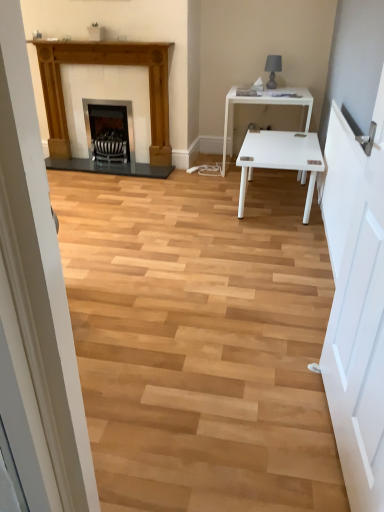
Question: Is matte black fireplace at center, which appears as the first fireplace when viewed from the right, completely or partially outside of matte black lamp at upper right?

Choices:
 (A) no
 (B) yes

Answer: (B)

Question: Is matte black fireplace at center, which appears as the first fireplace when viewed from the right, far away from matte black lamp at upper right?

Choices:
 (A) yes
 (B) no

Answer: (A)

Question: Does matte black fireplace at center, which appears as the first fireplace when viewed from the right, have a lesser width compared to matte black lamp at upper right?

Choices:
 (A) yes
 (B) no

Answer: (B)

Question: From the image's perspective, does matte black fireplace at center, which is the second fireplace from left to right, appear lower than matte black lamp at upper right?

Choices:
 (A) yes
 (B) no

Answer: (A)

Question: Considering the relative sizes of matte black fireplace at center, which is the second fireplace from left to right, and matte black lamp at upper right in the image provided, is matte black fireplace at center, which is the second fireplace from left to right, bigger than matte black lamp at upper right?

Choices:
 (A) yes
 (B) no

Answer: (A)

Question: Considering their positions, is white wooden door at right located in front of or behind matte black lamp at upper right?

Choices:
 (A) front
 (B) behind

Answer: (A)

Question: Based on their positions, is white wooden door at right located to the left or right of matte black lamp at upper right?

Choices:
 (A) left
 (B) right

Answer: (A)

Question: Is white wooden door at right wider or thinner than matte black lamp at upper right?

Choices:
 (A) wide
 (B) thin

Answer: (B)

Question: Considering the positions of point (337, 266) and point (271, 74), is point (337, 266) closer or farther from the camera than point (271, 74)?

Choices:
 (A) farther
 (B) closer

Answer: (B)

Question: In the image, is matte black fireplace at center, which is the second fireplace from left to right, positioned in front of or behind matte black lamp at upper right?

Choices:
 (A) front
 (B) behind

Answer: (B)

Question: Looking at the image, does matte black fireplace at center, which is the second fireplace from left to right, seem bigger or smaller compared to matte black lamp at upper right?

Choices:
 (A) big
 (B) small

Answer: (A)

Question: In terms of height, does matte black fireplace at center, which is the second fireplace from left to right, look taller or shorter compared to matte black lamp at upper right?

Choices:
 (A) short
 (B) tall

Answer: (B)

Question: In the image, is matte black fireplace at center, which is the second fireplace from left to right, on the left side or the right side of matte black lamp at upper right?

Choices:
 (A) right
 (B) left

Answer: (B)

Question: From the image's perspective, is wooden fireplace at left, the 2th fireplace from the right, above or below white glossy table at center?

Choices:
 (A) above
 (B) below

Answer: (A)

Question: Is wooden fireplace at left, which appears as the first fireplace when viewed from the left, situated inside white glossy table at center or outside?

Choices:
 (A) inside
 (B) outside

Answer: (B)